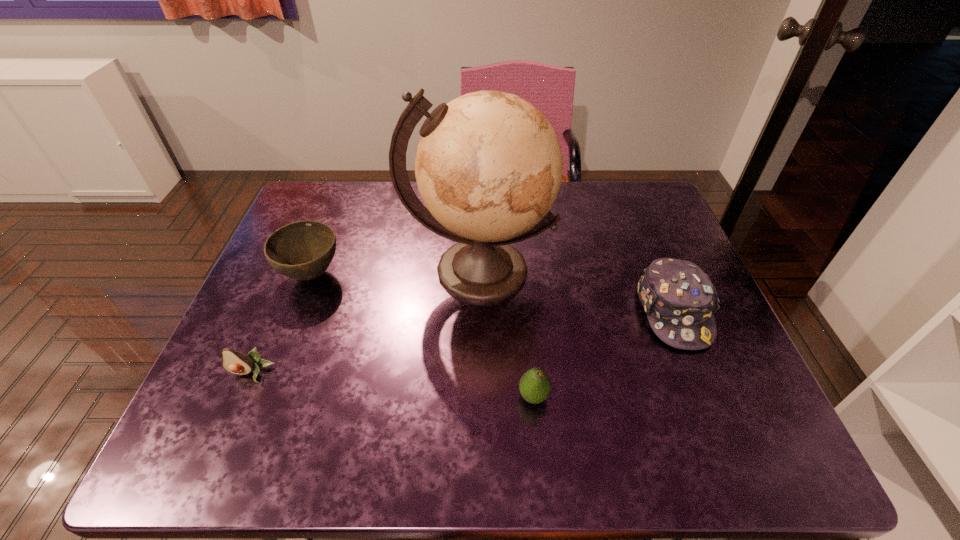
Find the location of a particular element. The height and width of the screenshot is (540, 960). free space between the farther avocado and the tallest object is located at coordinates (366, 321).

Where is `blank region between the nearest object and the fourth farthest object`? The width and height of the screenshot is (960, 540). blank region between the nearest object and the fourth farthest object is located at coordinates (393, 385).

What are the coordinates of `vacant area between the headwear and the left avocado` in the screenshot? It's located at (463, 343).

Locate an element on the screen. The height and width of the screenshot is (540, 960). free space between the tallest object and the rightmost object is located at coordinates (577, 291).

The image size is (960, 540). Identify the location of free space between the rightmost object and the nearest object. (604, 354).

Identify the location of free point between the fourth farthest object and the globe. The width and height of the screenshot is (960, 540). (366, 321).

The image size is (960, 540). Identify the location of free space between the second nearest object and the bowl. (282, 324).

This screenshot has height=540, width=960. I want to click on free spot between the globe and the right avocado, so click(x=506, y=333).

Find the location of a particular element. blank region between the nearer avocado and the globe is located at coordinates (506, 333).

This screenshot has width=960, height=540. Find the location of `vacant area that lies between the nearest object and the bowl`. vacant area that lies between the nearest object and the bowl is located at coordinates (422, 336).